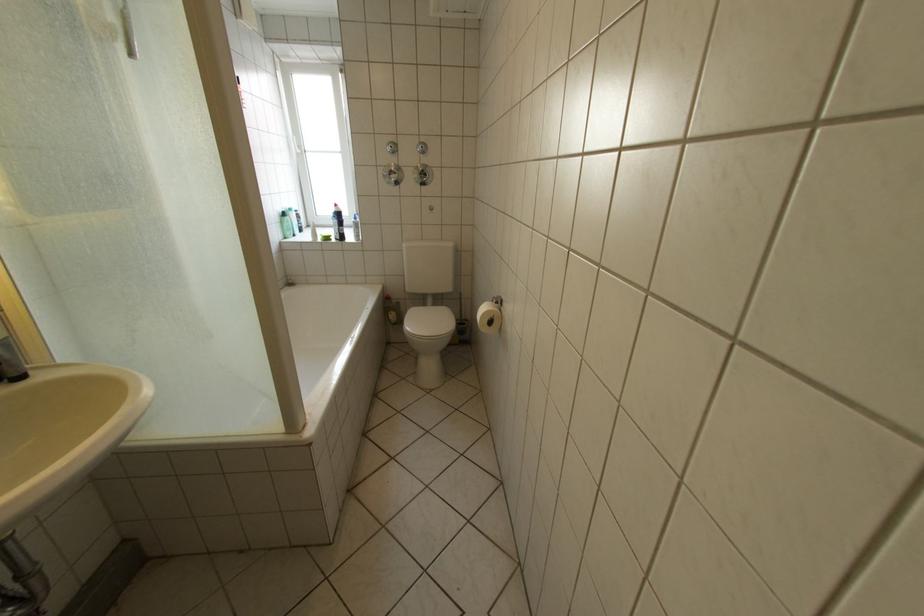
Where would you press the blue spray bottle? Please return your answer as a coordinate pair (x, y).

(286, 224)